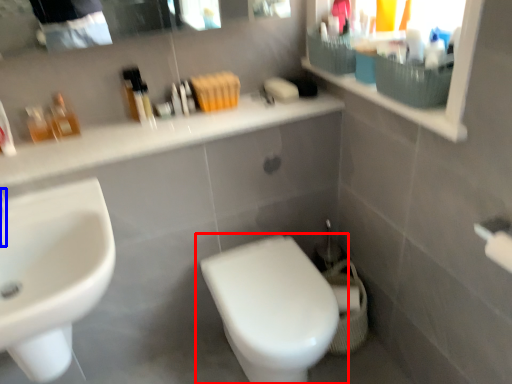
Question: Which object appears farthest to the camera in this image, toilet (highlighted by a red box) or faucet (highlighted by a blue box)?

Choices:
 (A) toilet
 (B) faucet

Answer: (A)